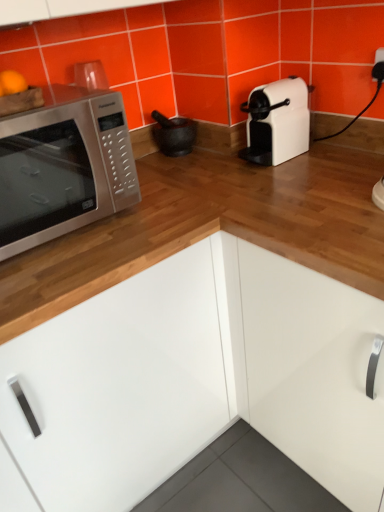
Question: From a real-world perspective, is satin silver microwave at left above or below matte black mortar at center?

Choices:
 (A) above
 (B) below

Answer: (A)

Question: Considering the positions of point (132, 179) and point (170, 139), is point (132, 179) closer or farther from the camera than point (170, 139)?

Choices:
 (A) farther
 (B) closer

Answer: (B)

Question: Considering the real-world distances, which object is closest to the matte black mortar at center?

Choices:
 (A) satin silver microwave at left
 (B) white glossy cabinet at center

Answer: (A)

Question: Which object is positioned farthest from the matte black mortar at center?

Choices:
 (A) white glossy cabinet at center
 (B) satin silver microwave at left

Answer: (A)